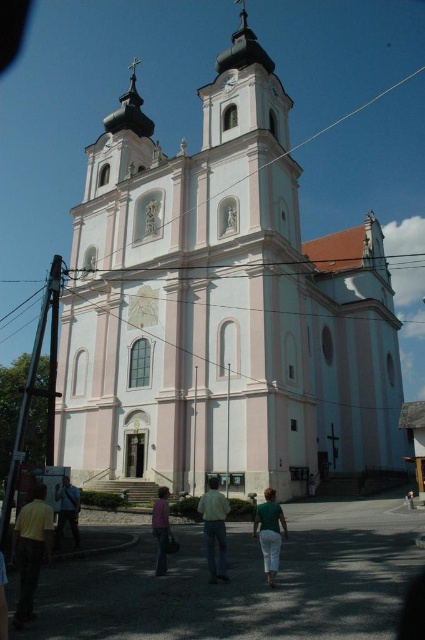
Image resolution: width=425 pixels, height=640 pixels. What do you see at coordinates (215, 529) in the screenshot?
I see `light blue jeans at center` at bounding box center [215, 529].

Is point (215, 545) positioned in front of point (159, 538)?

That is False.

Locate an element on the screen. Image resolution: width=425 pixels, height=640 pixels. light blue jeans at center is located at coordinates (215, 529).

Is point (214, 513) closer to camera compared to point (76, 532)?

That is True.

Is point (209, 502) farther from camera compared to point (76, 513)?

No, (209, 502) is in front of (76, 513).

Where is `light blue jeans at center`? The image size is (425, 640). light blue jeans at center is located at coordinates (215, 529).

Is green cotton pants at lower center positioned before pink fabric shirt at center?

Yes.

Is green cotton pants at lower center to the left of pink fabric shirt at center from the viewer's perspective?

Incorrect, green cotton pants at lower center is not on the left side of pink fabric shirt at center.

Who is more distant from viewer, (255,532) or (158,561)?

Point (158,561)

The image size is (425, 640). In order to click on green cotton pants at lower center in this screenshot , I will do `click(269, 532)`.